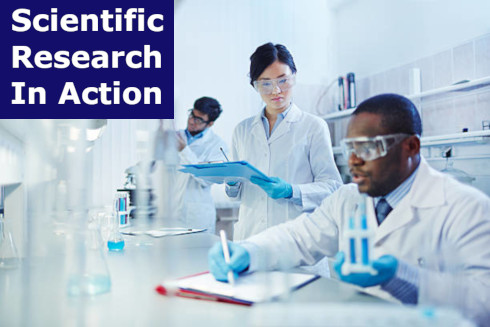
In order to click on pen in this screenshot , I will do `click(224, 151)`, `click(226, 246)`.